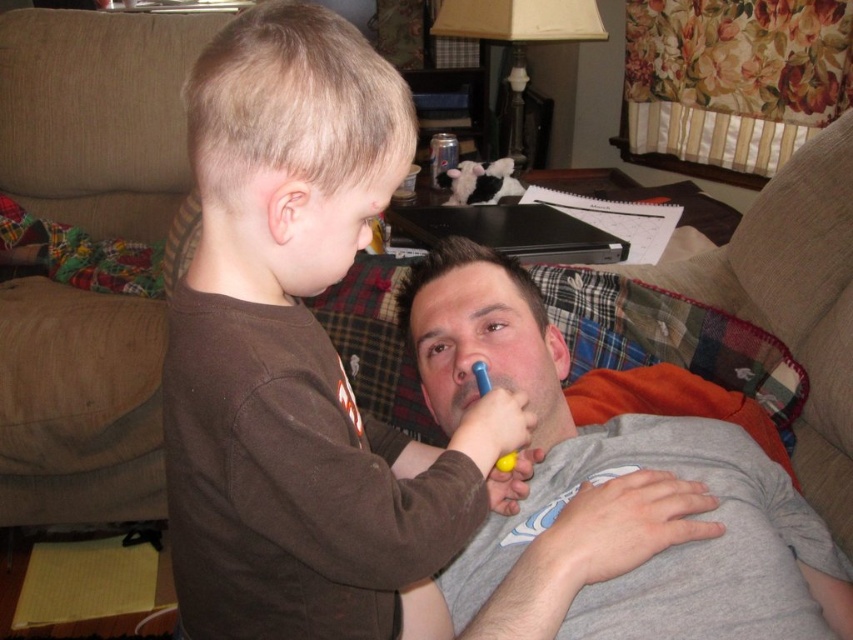
Question: Where is beige fabric couch at upper left located in relation to blue plastic toothbrush at center in the image?

Choices:
 (A) above
 (B) below

Answer: (A)

Question: Which object is positioned closest to the brown cotton shirt at upper left?

Choices:
 (A) blue plastic toothbrush at center
 (B) gray cotton shirt at center
 (C) beige fabric couch at upper left

Answer: (A)

Question: Where is gray cotton shirt at center located in relation to blue plastic toothbrush at center in the image?

Choices:
 (A) left
 (B) right

Answer: (B)

Question: Which point is closer to the camera?

Choices:
 (A) blue plastic toothbrush at center
 (B) beige fabric couch at upper left

Answer: (A)

Question: Can you confirm if brown cotton shirt at upper left is positioned to the left of beige fabric couch at upper left?

Choices:
 (A) no
 (B) yes

Answer: (A)

Question: Among these objects, which one is farthest from the camera?

Choices:
 (A) brown cotton shirt at upper left
 (B) gray cotton shirt at center
 (C) blue plastic toothbrush at center

Answer: (C)